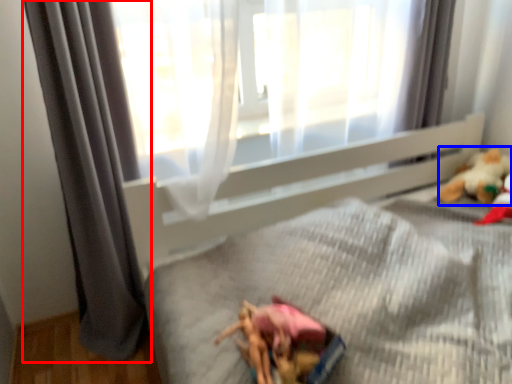
Question: Which of the following is the farthest to the observer, curtain (highlighted by a red box) or toy (highlighted by a blue box)?

Choices:
 (A) curtain
 (B) toy

Answer: (B)